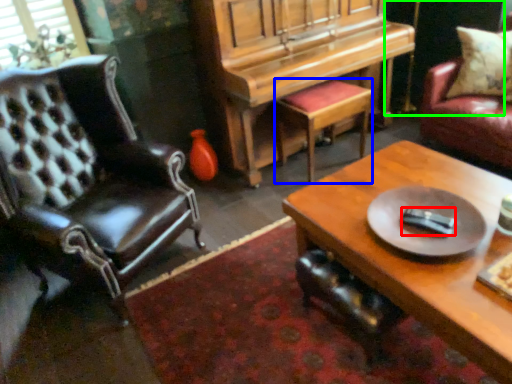
Question: Considering the real-world distances, which object is farthest from remote control (highlighted by a red box)? stool (highlighted by a blue box) or dark (highlighted by a green box)?

Choices:
 (A) stool
 (B) dark

Answer: (B)